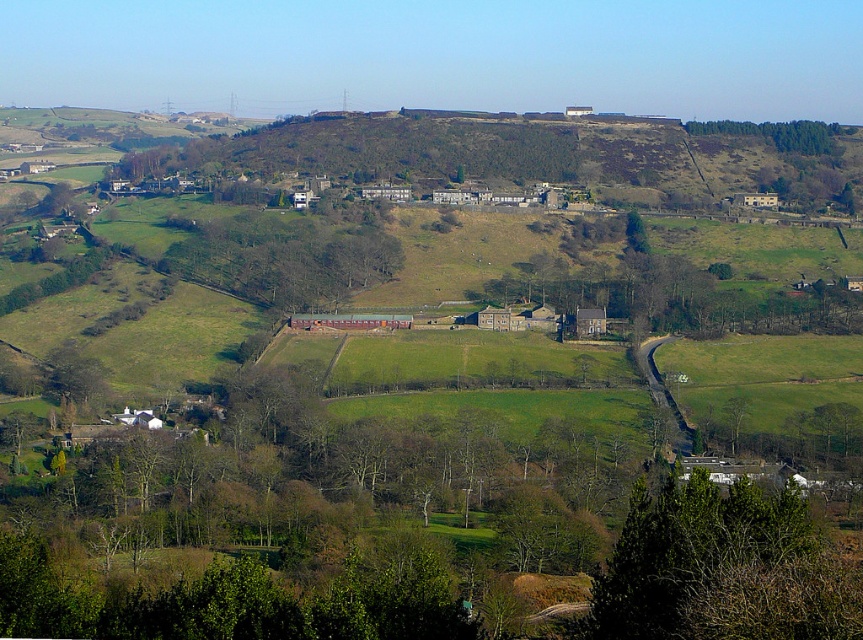
In the scene shown: Who is higher up, green leafy tree at lower right or green leafy trees at upper right?

Positioned higher is green leafy trees at upper right.

Can you confirm if green leafy tree at lower right is positioned above green leafy trees at upper right?

Incorrect, green leafy tree at lower right is not positioned above green leafy trees at upper right.

Which is in front, point (819, 628) or point (734, 131)?

Positioned in front is point (819, 628).

What are the coordinates of `green leafy tree at lower right` in the screenshot? It's located at (723, 568).

Is brown wooden fence at center above green leafy trees at upper right?

No, brown wooden fence at center is not above green leafy trees at upper right.

Can you confirm if brown wooden fence at center is taller than green leafy trees at upper right?

Incorrect, brown wooden fence at center's height is not larger of green leafy trees at upper right's.

Is point (395, 253) less distant than point (715, 122)?

Yes, point (395, 253) is in front of point (715, 122).

Identify the location of brown wooden fence at center. (284, 259).

Does green leafy tree at lower right have a larger size compared to brown wooden fence at center?

No, green leafy tree at lower right is not bigger than brown wooden fence at center.

Does point (658, 547) lie in front of point (285, 228)?

Yes.

Does point (681, 589) lie in front of point (275, 292)?

Yes.

Where is `green leafy tree at lower right`? This screenshot has height=640, width=863. green leafy tree at lower right is located at coordinates (723, 568).